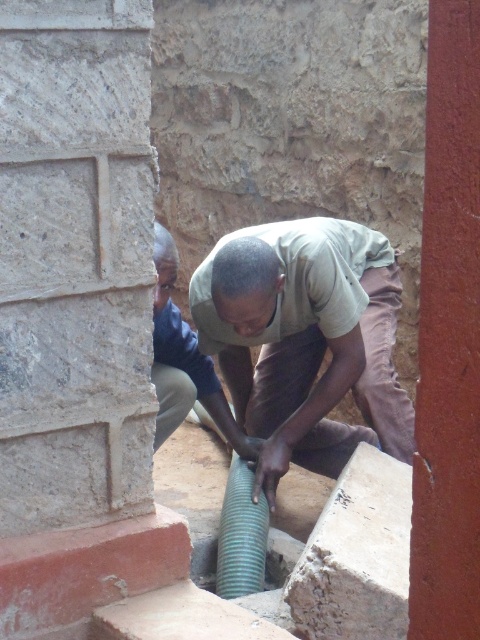
Between light brown fabric shirt at center and green corrugated pipe at center, which one is positioned lower?

Positioned lower is green corrugated pipe at center.

Identify the location of light brown fabric shirt at center. The width and height of the screenshot is (480, 640). (305, 339).

Is point (363, 316) positioned in front of point (205, 563)?

No, (363, 316) is behind (205, 563).

This screenshot has height=640, width=480. I want to click on light brown fabric shirt at center, so click(x=305, y=339).

How distant is light brown fabric shirt at center from smooth red pillar at right?

1.75 meters

Can you confirm if light brown fabric shirt at center is positioned to the right of smooth red pillar at right?

Incorrect, light brown fabric shirt at center is not on the right side of smooth red pillar at right.

Does point (304, 390) lie behind point (471, 65)?

Yes, it is behind point (471, 65).

Locate an element on the screen. The image size is (480, 640). light brown fabric shirt at center is located at coordinates (305, 339).

In the scene shown: Who is more forward, [172,282] or [218,540]?

Point [172,282] is more forward.

Does matte green corrugated pipe at center have a lesser height compared to green ribbed pipe at center?

In fact, matte green corrugated pipe at center may be taller than green ribbed pipe at center.

Is point (186, 390) farther from camera compared to point (223, 589)?

That is True.

Locate an element on the screen. matte green corrugated pipe at center is located at coordinates (186, 360).